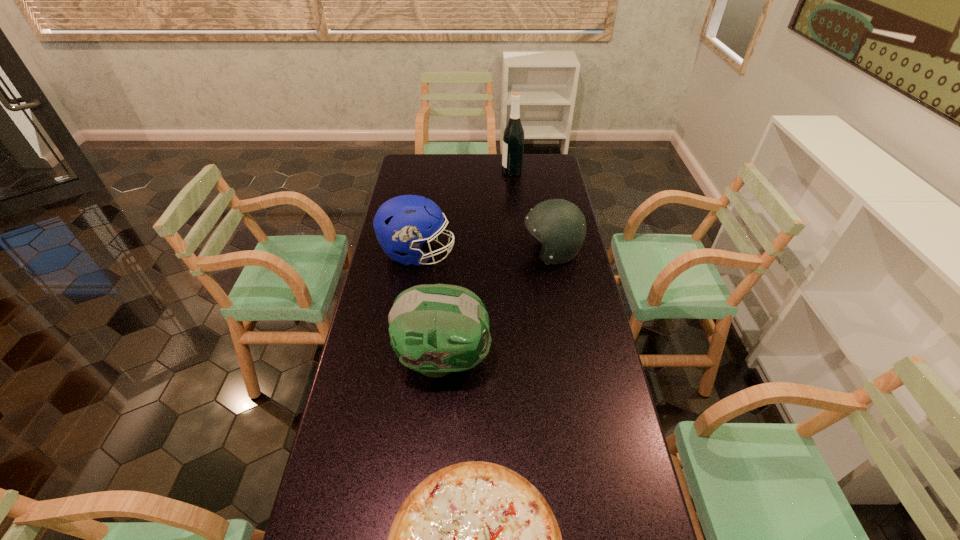
Locate which object is the fourth closest to the second nearest object. Please provide its 2D coordinates. Your answer should be formatted as a tuple, i.e. [(x, y)], where the tuple contains the x and y coordinates of a point satisfying the conditions above.

[(513, 138)]

The width and height of the screenshot is (960, 540). Find the location of `the second closest football helmet to the rightmost football helmet`. the second closest football helmet to the rightmost football helmet is located at coordinates (435, 329).

Choose which football helmet is the second nearest neighbor to the rightmost football helmet. Please provide its 2D coordinates. Your answer should be formatted as a tuple, i.e. [(x, y)], where the tuple contains the x and y coordinates of a point satisfying the conditions above.

[(435, 329)]